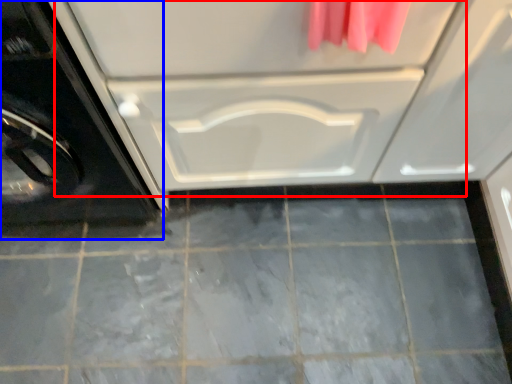
Question: Which point is closer to the camera, drawer (highlighted by a red box) or washing machine (highlighted by a blue box)?

Choices:
 (A) drawer
 (B) washing machine

Answer: (B)